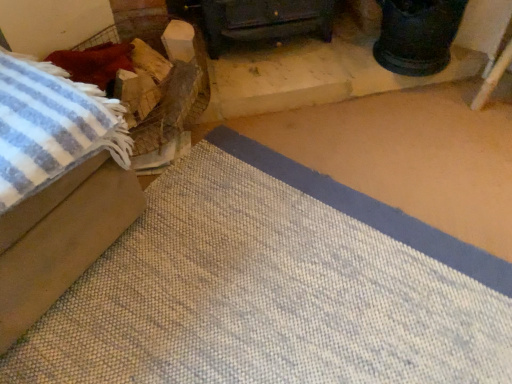
Question: From the image's perspective, is beige fabric ottoman at left, marked as the 2th furniture in a back-to-front arrangement, above or below dark wood stove at center, which appears as the 1th furniture when viewed from the right?

Choices:
 (A) below
 (B) above

Answer: (A)

Question: From a real-world perspective, is beige fabric ottoman at left, which is the second furniture in right-to-left order, physically located above or below dark wood stove at center, the 1th furniture viewed from the back?

Choices:
 (A) below
 (B) above

Answer: (B)

Question: Considering their positions, is beige fabric ottoman at left, which is the 1th furniture from left to right, located in front of or behind dark wood stove at center, which appears as the second furniture when viewed from the left?

Choices:
 (A) front
 (B) behind

Answer: (A)

Question: Would you say dark wood stove at center, which appears as the 1th furniture when viewed from the right, is to the left or to the right of beige fabric ottoman at left, marked as the 2th furniture in a back-to-front arrangement, in the picture?

Choices:
 (A) left
 (B) right

Answer: (B)

Question: Is point (309, 18) closer or farther from the camera than point (39, 231)?

Choices:
 (A) closer
 (B) farther

Answer: (B)

Question: In terms of width, does dark wood stove at center, which appears as the second furniture when viewed from the left, look wider or thinner when compared to beige fabric ottoman at left, the first furniture positioned from the front?

Choices:
 (A) wide
 (B) thin

Answer: (B)

Question: From a real-world perspective, is dark wood stove at center, which appears as the second furniture when viewed from the left, positioned above or below beige fabric ottoman at left, which is the second furniture in right-to-left order?

Choices:
 (A) above
 (B) below

Answer: (B)